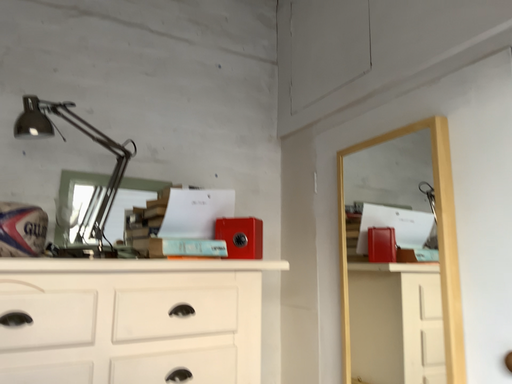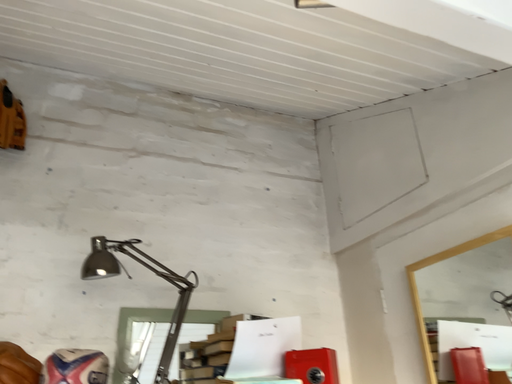
Question: Which way did the camera rotate in the video?

Choices:
 (A) rotated downward
 (B) rotated upward

Answer: (B)